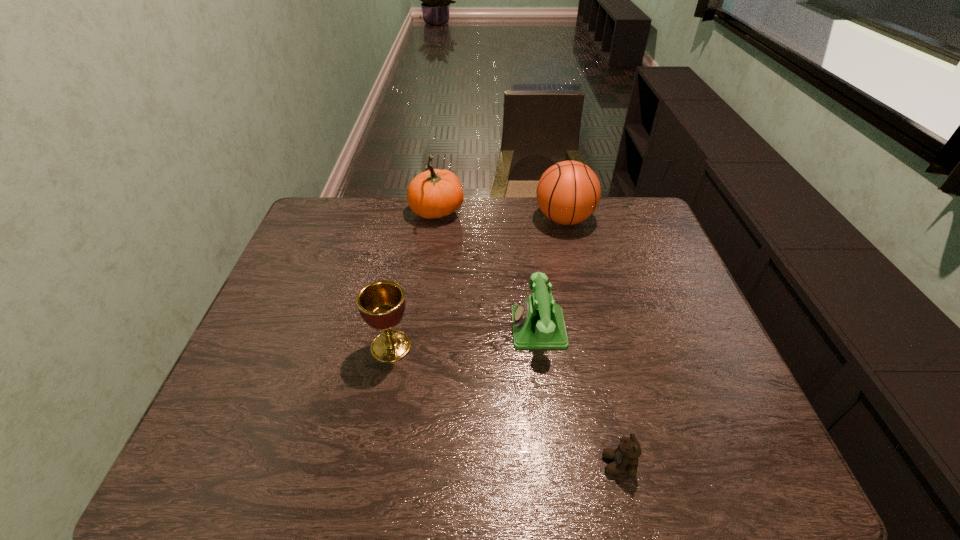
Where is `vacant area that lies between the pumpkin and the basketball`? vacant area that lies between the pumpkin and the basketball is located at coordinates (500, 216).

What are the coordinates of `blank region between the teddy bear and the basketball` in the screenshot? It's located at (591, 341).

You are a GUI agent. You are given a task and a screenshot of the screen. Output one action in this format:
    pyautogui.click(x=<x>, y=<y>)
    Task: Click on the free spot between the third shortest object and the pumpkin
    The height and width of the screenshot is (540, 960).
    Given the screenshot: What is the action you would take?
    pyautogui.click(x=414, y=280)

Where is `free space between the telephone and the chalice`? free space between the telephone and the chalice is located at coordinates (465, 338).

Where is `object identified as the second closest to the pumpkin`? object identified as the second closest to the pumpkin is located at coordinates (538, 323).

The width and height of the screenshot is (960, 540). I want to click on the third closest object to the pumpkin, so click(x=381, y=304).

Find the location of a particular element. This screenshot has height=540, width=960. vacant space that satisfies the following two spatial constraints: 1. on the front side of the basketball; 2. on the face of the nearest object is located at coordinates (622, 464).

You are a GUI agent. You are given a task and a screenshot of the screen. Output one action in this format:
    pyautogui.click(x=<x>, y=<y>)
    Task: Click on the vacant region that satisfies the following two spatial constraints: 1. on the back side of the chalice; 2. on the left side of the pumpkin
    
    Given the screenshot: What is the action you would take?
    pyautogui.click(x=416, y=213)